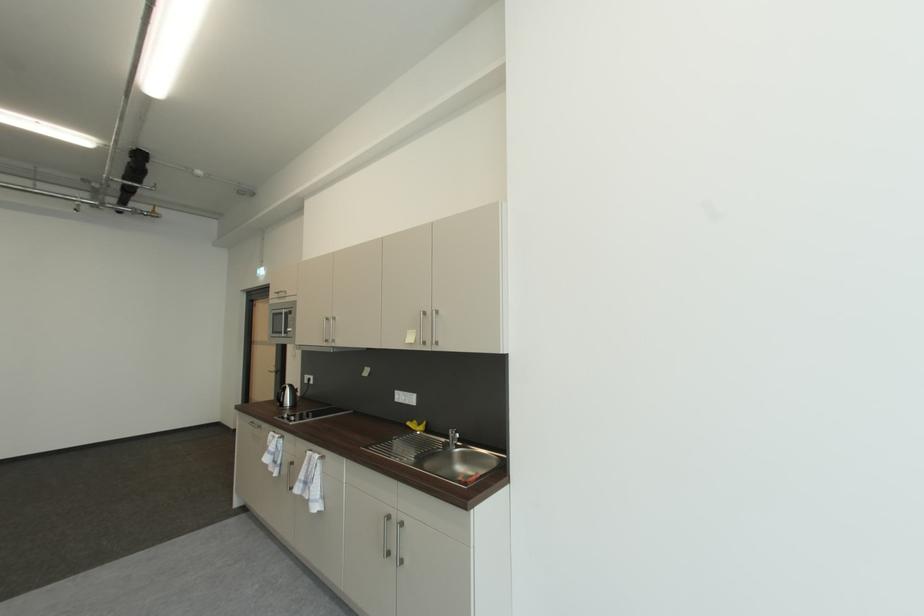
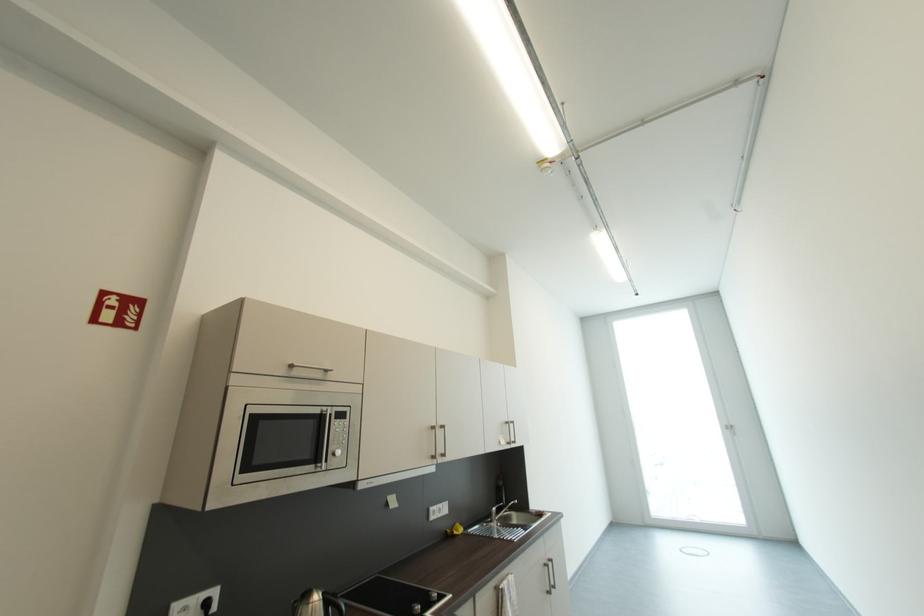
In the second image, find the point that corresponds to point 285,294 in the first image.

(298, 368)